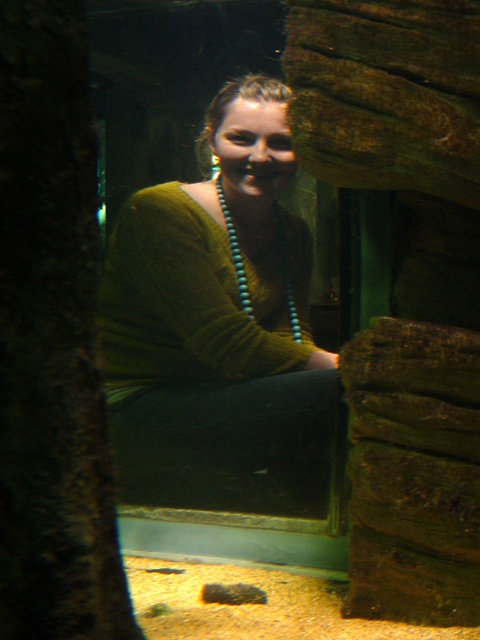
Who is more distant from viewer, (282, 464) or (233, 264)?

Point (233, 264)

Measure the distance between green matte sweater at center and camera.

green matte sweater at center is 6.66 feet from camera.

Does point (194, 362) lie in front of point (297, 328)?

That is True.

Image resolution: width=480 pixels, height=640 pixels. I want to click on green matte sweater at center, so click(218, 328).